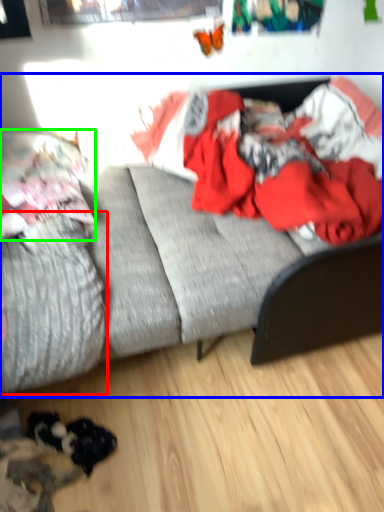
Question: Which object is the farthest from mattress (highlighted by a red box)? Choose among these: studio couch (highlighted by a blue box) or pillow (highlighted by a green box).

Choices:
 (A) studio couch
 (B) pillow

Answer: (B)